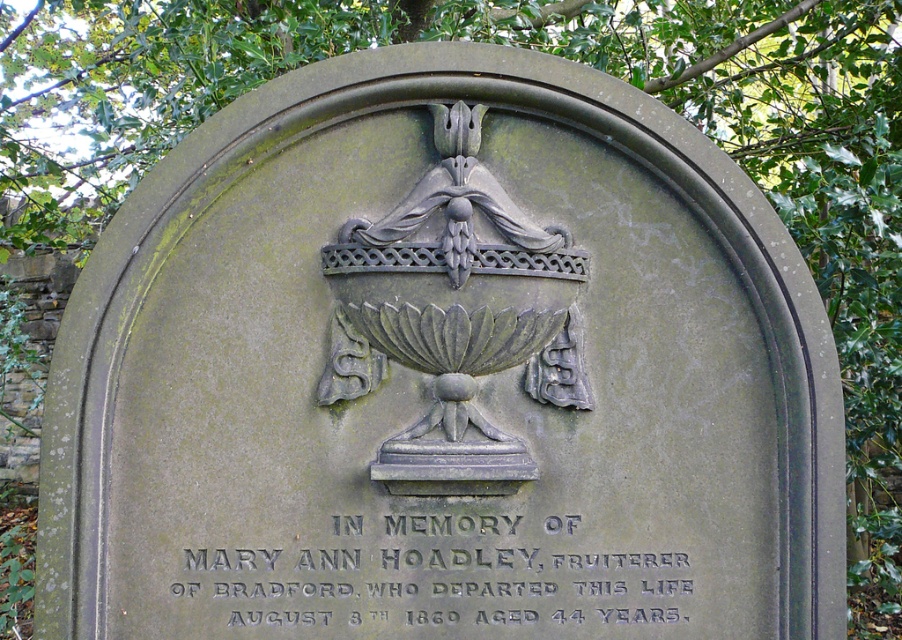
Question: Where is black engraved text at center located in relation to dark gray stone urn at center in the image?

Choices:
 (A) right
 (B) left

Answer: (B)

Question: Which of the following is the closest to the observer?

Choices:
 (A) (642, 605)
 (B) (476, 368)

Answer: (A)

Question: Is black engraved text at center closer to the viewer compared to dark gray stone urn at center?

Choices:
 (A) no
 (B) yes

Answer: (A)

Question: Which of the following is the farthest from the observer?

Choices:
 (A) dark gray stone urn at center
 (B) black engraved text at center

Answer: (B)

Question: In this image, where is black engraved text at center located relative to dark gray stone urn at center?

Choices:
 (A) above
 (B) below

Answer: (B)